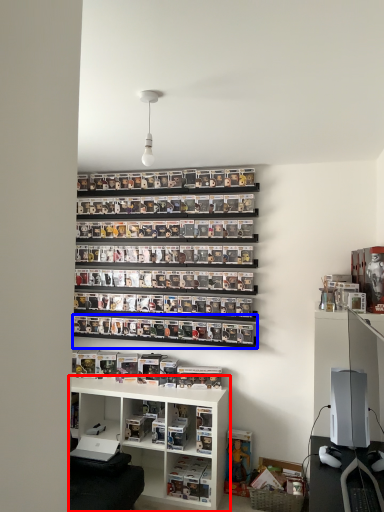
Question: Which object is further to the camera taking this photo, shelf (highlighted by a red box) or shelf (highlighted by a blue box)?

Choices:
 (A) shelf
 (B) shelf

Answer: (B)